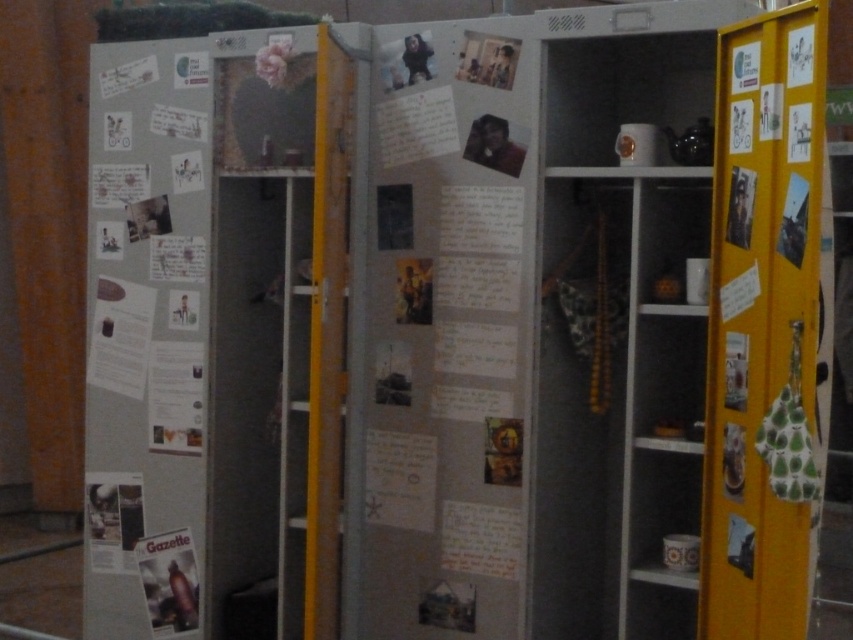
Who is positioned more to the right, matte paper poster at center or matte paper poster at left?

Positioned to the right is matte paper poster at center.

Measure the distance between matte paper poster at center and matte paper poster at left.

The distance of matte paper poster at center from matte paper poster at left is 32.60 inches.

This screenshot has width=853, height=640. What do you see at coordinates (445, 330) in the screenshot?
I see `matte paper poster at center` at bounding box center [445, 330].

The height and width of the screenshot is (640, 853). Find the location of `matte paper poster at center`. matte paper poster at center is located at coordinates (445, 330).

Which is more to the left, matte paper poster at center or matte paper gazette at lower left?

matte paper gazette at lower left is more to the left.

Measure the distance between matte paper poster at center and camera.

A distance of 2.69 meters exists between matte paper poster at center and camera.

This screenshot has height=640, width=853. I want to click on matte paper poster at center, so click(x=445, y=330).

Can you confirm if yellow matte bulletin board at right is positioned below matte paper gazette at lower left?

No, yellow matte bulletin board at right is not below matte paper gazette at lower left.

Is yellow matte bulletin board at right thinner than matte paper gazette at lower left?

Yes.

Which is behind, point (792, 275) or point (198, 579)?

The point (198, 579) is more distant.

Find the location of a particular element. yellow matte bulletin board at right is located at coordinates (763, 328).